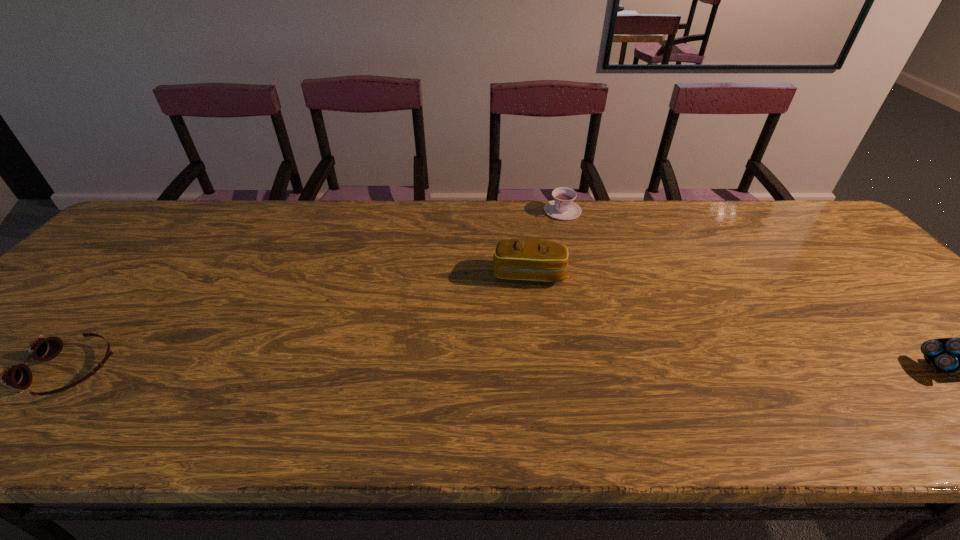
Identify the location of the shortest object. (19, 376).

I want to click on the leftmost object, so click(x=19, y=376).

This screenshot has height=540, width=960. I want to click on the third nearest object, so click(x=536, y=260).

I want to click on the farthest object, so click(x=562, y=207).

The height and width of the screenshot is (540, 960). I want to click on free space located 0.210m on the zipper side of the clutch bag, so click(517, 351).

Image resolution: width=960 pixels, height=540 pixels. I want to click on blank space located on the zipper side of the clutch bag, so click(x=519, y=335).

Where is `vacant space located 0.170m on the zipper side of the clutch bag`? vacant space located 0.170m on the zipper side of the clutch bag is located at coordinates (519, 338).

Where is `vacant space situated on the handle side of the farthest object`? The image size is (960, 540). vacant space situated on the handle side of the farthest object is located at coordinates (518, 301).

Locate an element on the screen. vacant space located on the handle side of the farthest object is located at coordinates (523, 291).

Where is `free space located 0.090m on the handle side of the farthest object`? The height and width of the screenshot is (540, 960). free space located 0.090m on the handle side of the farthest object is located at coordinates (550, 236).